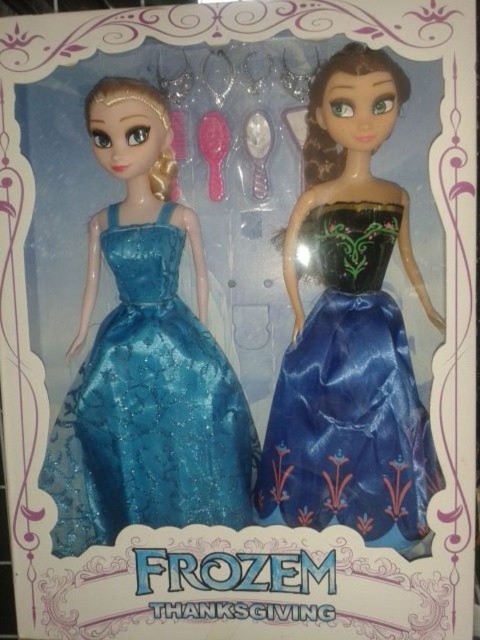
You are a collector examining the two dolls in the box. Which doll is closer to you, the shiny blue satin dress at left or the blue satin dress at right?

The shiny blue satin dress at left is closer to you because it is positioned further to the viewer than the blue satin dress at right.

You are a customer trying to place a sticker on one of the dolls in the box. You want to put it on the doll that is closer to you. Which point should you choose, point (216, 522) or point (363, 440)?

Point (216, 522) is further to the viewer than point (363, 440), so you should choose point (216, 522) to place the sticker as it is closer to you.